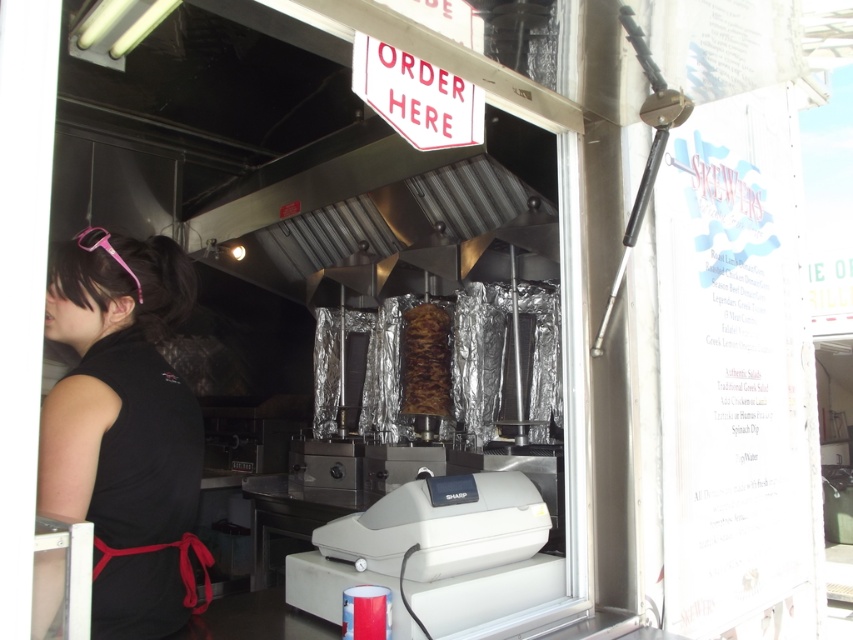
Question: Does brown crispy skewer at center appear under pink plastic goggles at upper left?

Choices:
 (A) yes
 (B) no

Answer: (A)

Question: Considering the relative positions of black fabric apron at left and pink plastic goggles at upper left in the image provided, where is black fabric apron at left located with respect to pink plastic goggles at upper left?

Choices:
 (A) below
 (B) above

Answer: (A)

Question: Which point is farther to the camera?

Choices:
 (A) (77, 234)
 (B) (144, 342)

Answer: (A)

Question: Which of the following is the closest to the observer?

Choices:
 (A) brown crispy skewer at center
 (B) pink plastic goggles at upper left
 (C) black fabric apron at left

Answer: (C)

Question: Which of these objects is positioned farthest from the black fabric apron at left?

Choices:
 (A) pink plastic goggles at upper left
 (B) brown crispy skewer at center

Answer: (B)

Question: Does black fabric apron at left have a lesser width compared to pink plastic goggles at upper left?

Choices:
 (A) yes
 (B) no

Answer: (B)